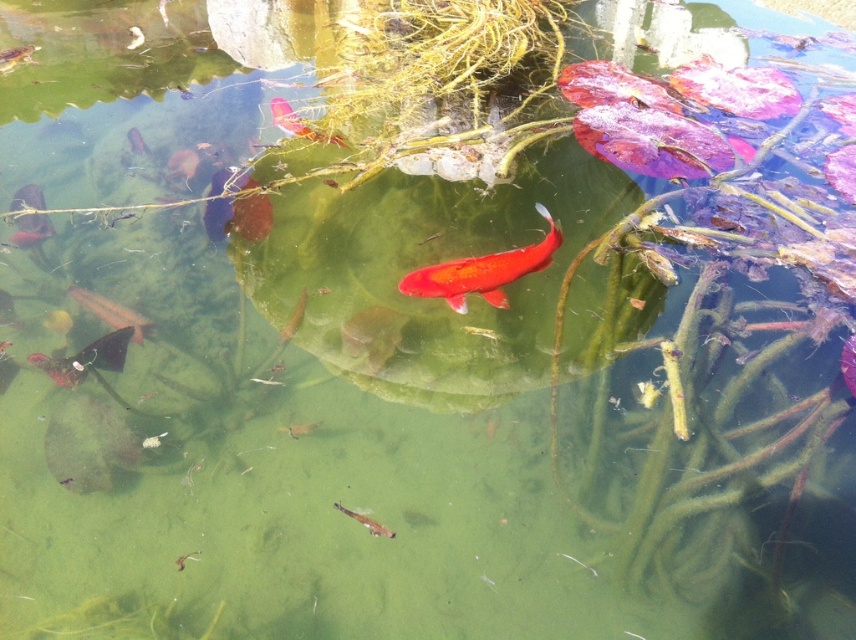
Question: Which is nearer to the shiny orange fish at upper center?

Choices:
 (A) shiny silver fish at center
 (B) shiny metallic fish at lower left
 (C) shiny metallic fish at bottom left

Answer: (B)

Question: Is shiny orange fish at center smaller than shiny silver fish at center?

Choices:
 (A) no
 (B) yes

Answer: (A)

Question: Estimate the real-world distances between objects in this image. Which object is farther from the shiny silver fish at center?

Choices:
 (A) shiny orange fish at upper center
 (B) shiny orange fish at center

Answer: (A)

Question: Can you confirm if shiny orange fish at center is bigger than shiny silver fish at center?

Choices:
 (A) yes
 (B) no

Answer: (A)

Question: Does shiny orange fish at center have a greater width compared to shiny orange fish at upper center?

Choices:
 (A) yes
 (B) no

Answer: (A)

Question: Which object is positioned farthest from the shiny metallic fish at bottom left?

Choices:
 (A) shiny orange fish at upper center
 (B) shiny silver fish at center
 (C) shiny orange fish at center
 (D) shiny metallic fish at lower left

Answer: (C)